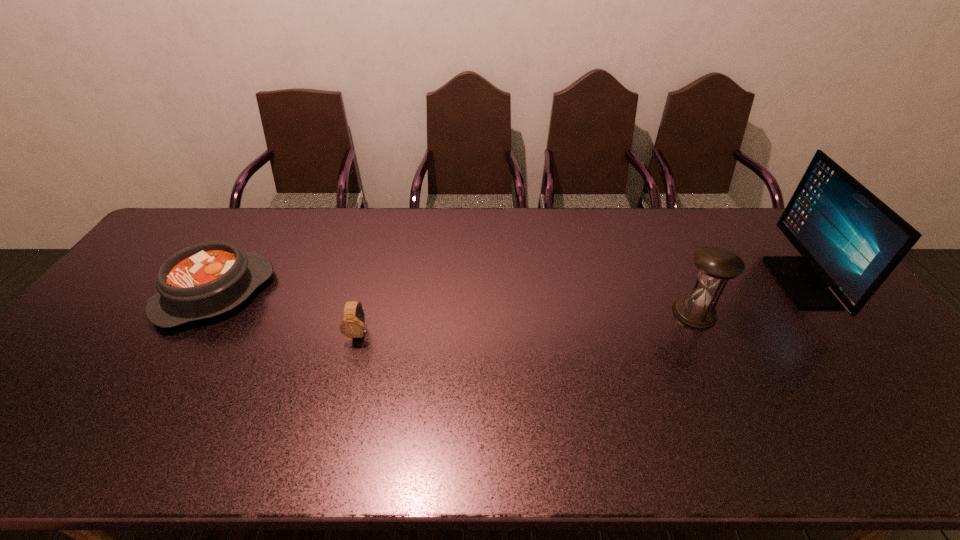
Find the location of a particular element. The width and height of the screenshot is (960, 540). vacant space situated on the right of the leftmost object is located at coordinates (371, 293).

Locate an element on the screen. Image resolution: width=960 pixels, height=540 pixels. vacant space located on the face of the watch is located at coordinates [344, 393].

This screenshot has width=960, height=540. I want to click on object present at the far edge, so click(x=850, y=241).

The height and width of the screenshot is (540, 960). What are the coordinates of `object that is at the left edge` in the screenshot? It's located at (207, 279).

Find the location of a particular element. The height and width of the screenshot is (540, 960). object located at the right edge is located at coordinates (850, 241).

Find the location of a particular element. This screenshot has width=960, height=540. object at the far right corner is located at coordinates (850, 241).

Where is `vacant area at the far edge`? The height and width of the screenshot is (540, 960). vacant area at the far edge is located at coordinates (426, 219).

In the image, there is a desktop. Where is `vacant space at the near edge`? The width and height of the screenshot is (960, 540). vacant space at the near edge is located at coordinates (684, 459).

Find the location of a particular element. vacant space at the left edge is located at coordinates (56, 389).

Find the location of a particular element. This screenshot has height=540, width=960. vacant space at the right edge of the desktop is located at coordinates (895, 383).